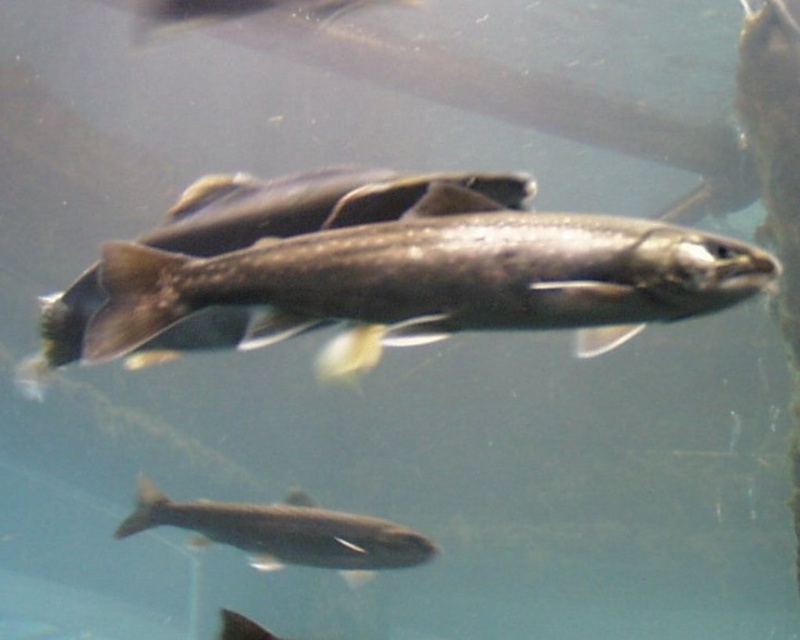
Does shiny silver fish at center have a greater height compared to silvery metallic fish at bottom center?

In fact, shiny silver fish at center may be shorter than silvery metallic fish at bottom center.

Who is positioned more to the left, shiny silver fish at center or silvery metallic fish at bottom center?

Positioned to the left is silvery metallic fish at bottom center.

Which is in front, point (392, 344) or point (400, 538)?

Positioned in front is point (392, 344).

Locate an element on the screen. shiny silver fish at center is located at coordinates (433, 280).